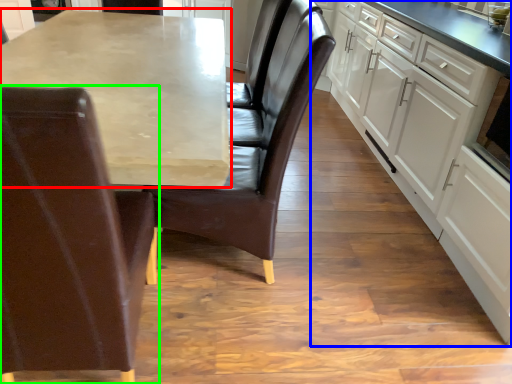
Question: Which is nearer to the countertop (highlighted by a red box)? cabinetry (highlighted by a blue box) or chair (highlighted by a green box).

Choices:
 (A) cabinetry
 (B) chair

Answer: (B)